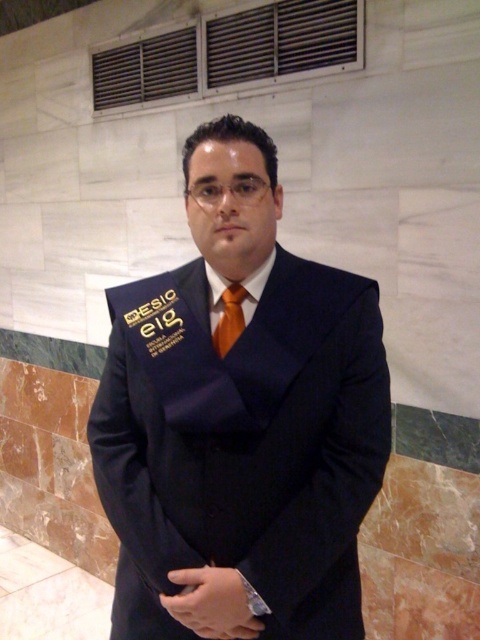
Question: Can you confirm if navy blue suit at center is positioned above orange satin tie at center?

Choices:
 (A) yes
 (B) no

Answer: (B)

Question: Does navy blue suit at center have a greater width compared to orange satin tie at center?

Choices:
 (A) no
 (B) yes

Answer: (B)

Question: Does navy blue suit at center have a smaller size compared to orange satin tie at center?

Choices:
 (A) no
 (B) yes

Answer: (A)